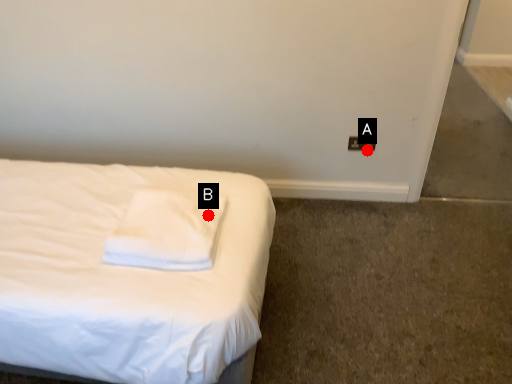
Question: Two points are circled on the image, labeled by A and B beside each circle. Which point is further to the camera?

Choices:
 (A) A is further
 (B) B is further

Answer: (A)